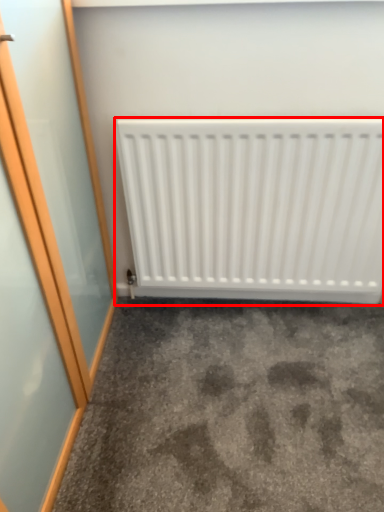
Question: Observing the image, what is the correct spatial positioning of radiator (annotated by the red box) in reference to concrete?

Choices:
 (A) right
 (B) left

Answer: (A)